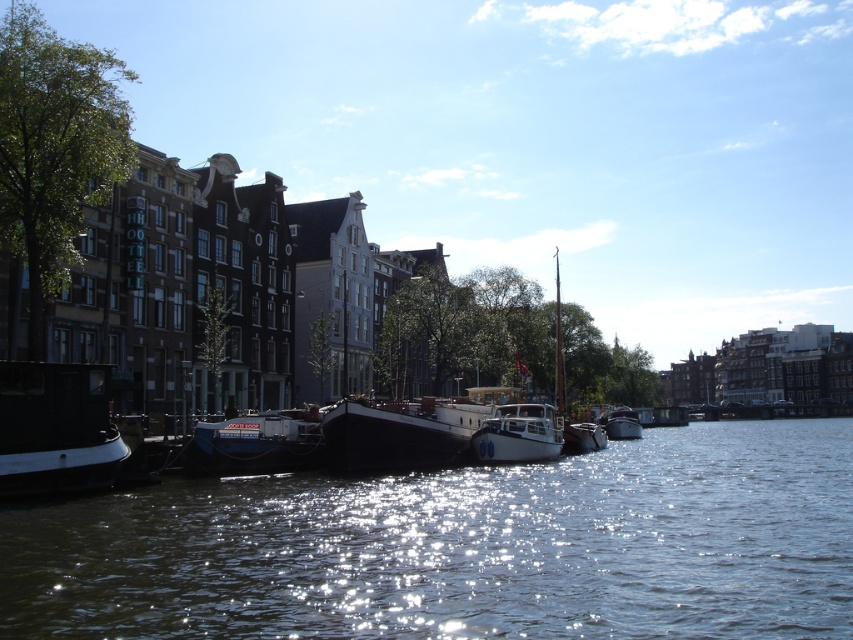
Question: Can you confirm if shiny black boat at lower left is positioned to the right of black matte boat at center?

Choices:
 (A) no
 (B) yes

Answer: (A)

Question: Which point is farther from the camera taking this photo?

Choices:
 (A) (578, 444)
 (B) (357, 449)
 (C) (1, 467)
 (D) (633, 436)

Answer: (D)

Question: Does black matte boat at center appear under white matte boat at center?

Choices:
 (A) yes
 (B) no

Answer: (B)

Question: Which point is closer to the camera taking this photo?

Choices:
 (A) coord(637,436)
 (B) coord(564,440)

Answer: (B)

Question: Which point is closer to the camera?

Choices:
 (A) black matte boat at center
 (B) white matte boat at center
 (C) shiny white boat at center
 (D) blue matte boat at center

Answer: (D)

Question: Is shiny dark water at lower center bigger than white matte boat at center?

Choices:
 (A) yes
 (B) no

Answer: (A)